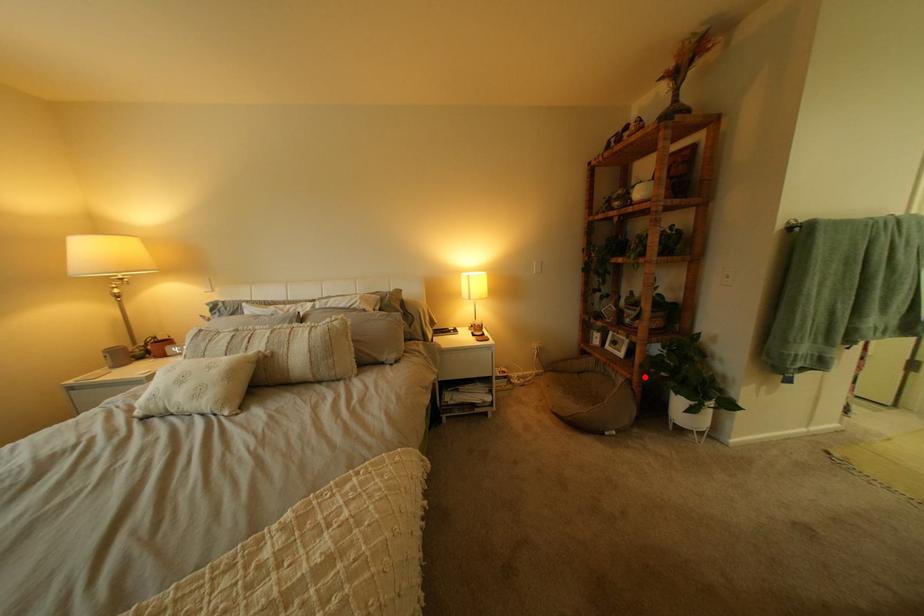
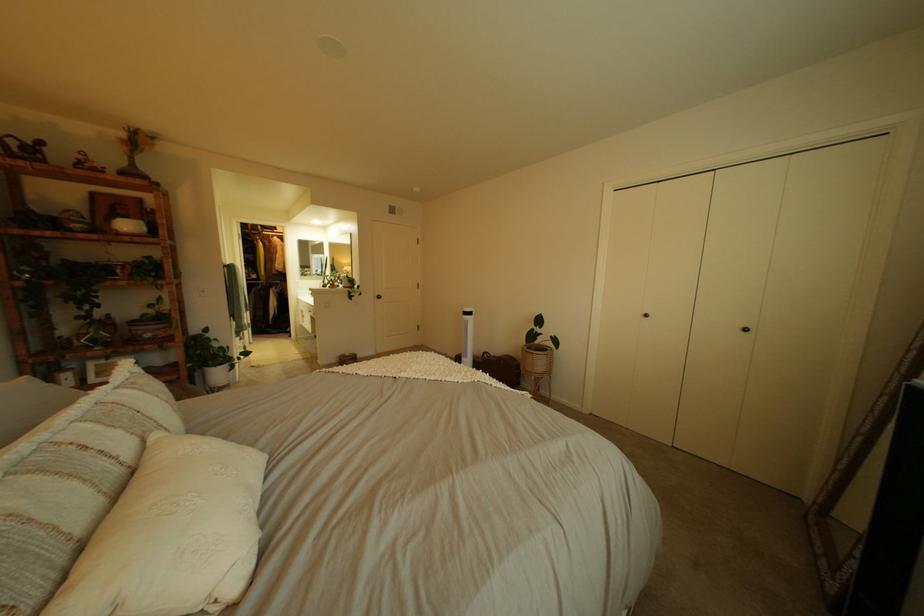
Where in the second image is the point corresponding to the highlighted location from the first image?

(189, 379)